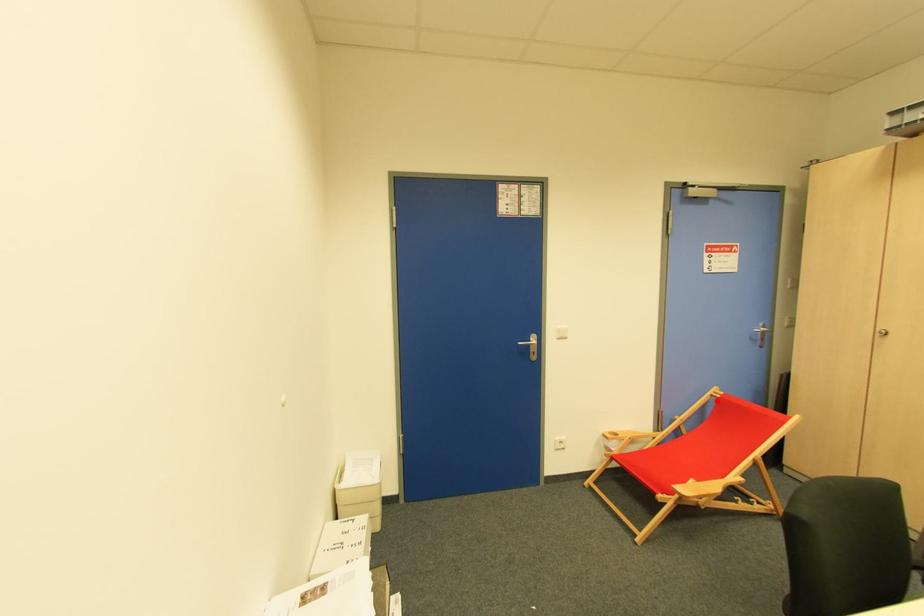
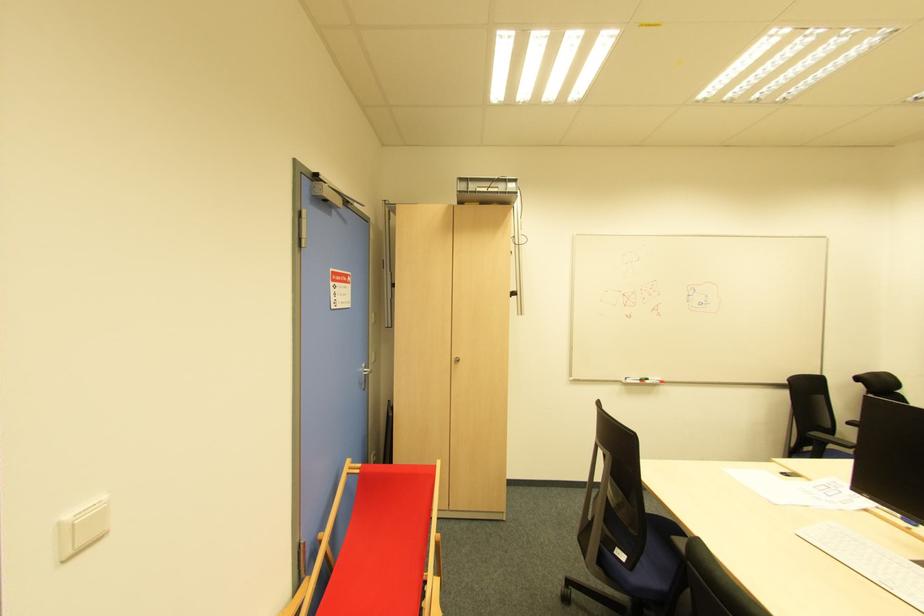
Question: I am providing you with two images of the same scene from different viewpoints. A red point is marked on the first image. Is the red point's position out of view in image 2?

Choices:
 (A) Yes
 (B) No

Answer: (B)